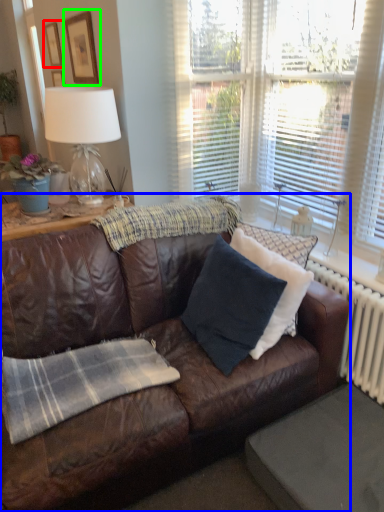
Question: Estimate the real-world distances between objects in this image. Which object is farther from picture frame (highlighted by a red box), studio couch (highlighted by a blue box) or picture frame (highlighted by a green box)?

Choices:
 (A) studio couch
 (B) picture frame

Answer: (A)